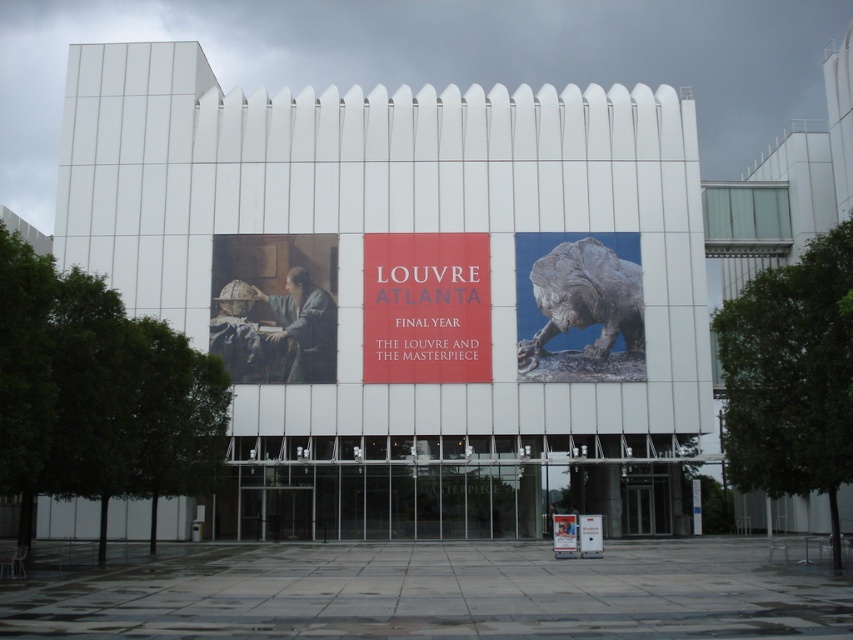
Question: Can you confirm if matte red sign at center is positioned to the right of bronze statue at right?

Choices:
 (A) yes
 (B) no

Answer: (B)

Question: Which object appears farthest from the camera in this image?

Choices:
 (A) matte white sign at center
 (B) matte red sign at center

Answer: (B)

Question: Among these points, which one is farthest from the camera?

Choices:
 (A) (473, 298)
 (B) (578, 317)

Answer: (A)

Question: Where is matte red sign at center located in relation to matte white sign at center in the image?

Choices:
 (A) right
 (B) left

Answer: (B)

Question: Does bronze statue at right appear on the right side of matte white sign at center?

Choices:
 (A) no
 (B) yes

Answer: (B)

Question: Which object appears farthest from the camera in this image?

Choices:
 (A) bronze statue at right
 (B) matte red sign at center
 (C) matte white sign at center

Answer: (A)